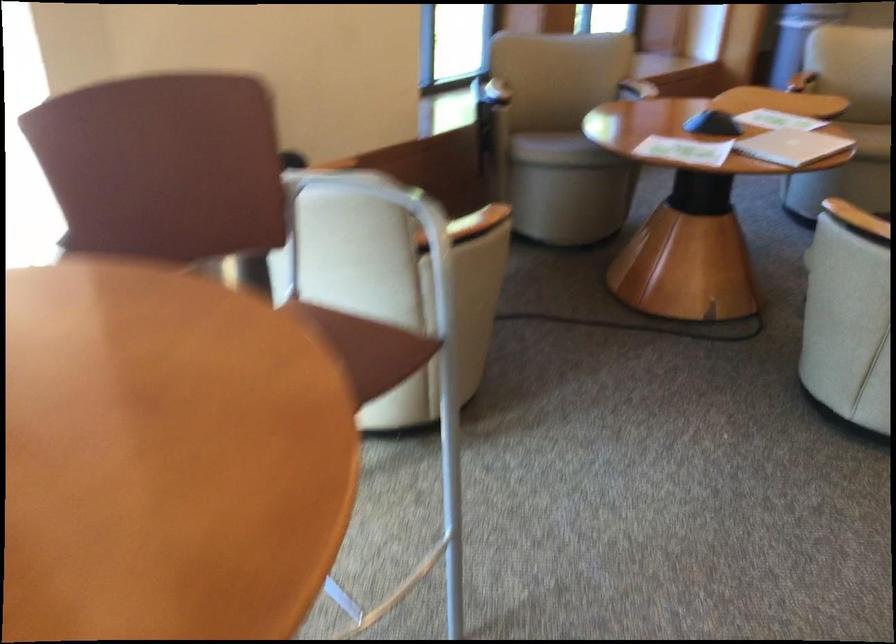
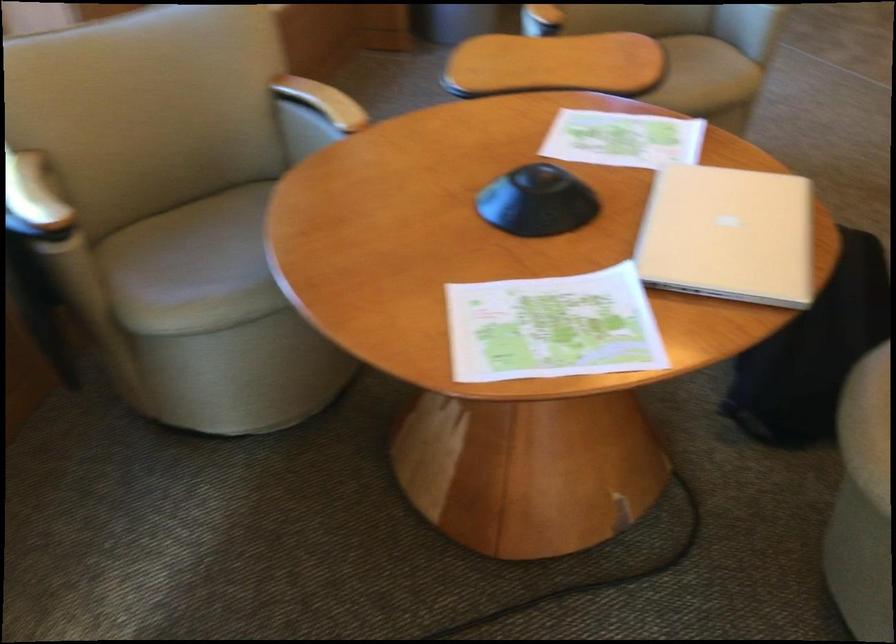
Locate, in the second image, the point that corresponds to (504,80) in the first image.

(33, 200)